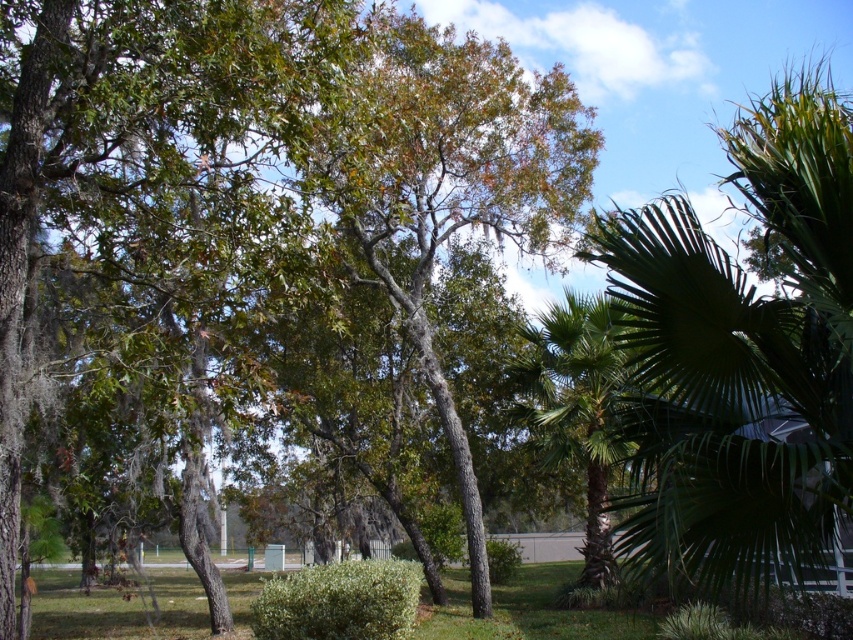
Consider the image. You are a gardener who needs to water the green grass at lower left and the green leafy palm at center. Your watering can holds enough water to cover 5 meters. Can you water both without refilling?

The distance between the green grass at lower left and the green leafy palm at center is 4.66 meters, so yes, you can water both without needing to refill your watering can since the distance is within the 5 meters capacity.

You are a gardener planning to plant flowers between the green leafy palm at right and the green grass at lower left. Based on their positions, where should you place the flowers to ensure they are between both objects?

The green leafy palm at right is above the green grass at lower left, so you should plant the flowers in the middle area between them, ensuring they are positioned below the palm and above the grass to be between both objects.

Consider the image. You are planning to place a picnic blanket in the green grass at lower left. Considering the space available, will the green leafy tree at center block your view of the sky?

The green leafy tree at center is narrower than the green grass at lower left, so it won not block your view of the sky.